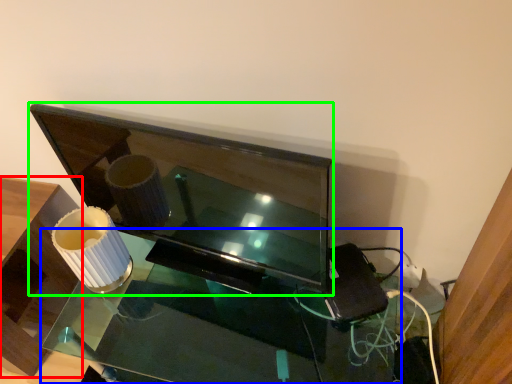
Question: Which object is positioned farthest from furniture (highlighted by a red box)? Select from table (highlighted by a blue box) and television (highlighted by a green box).

Choices:
 (A) table
 (B) television

Answer: (B)